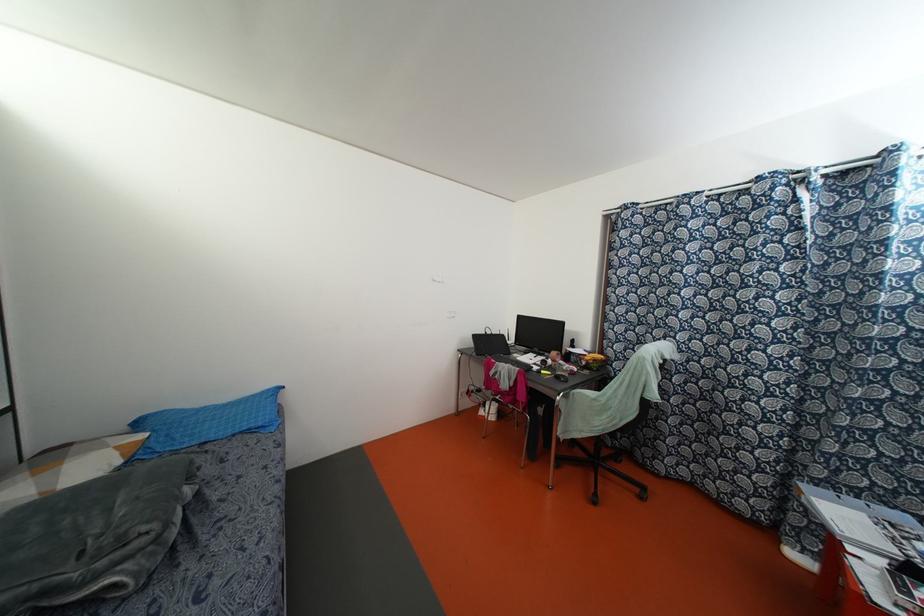
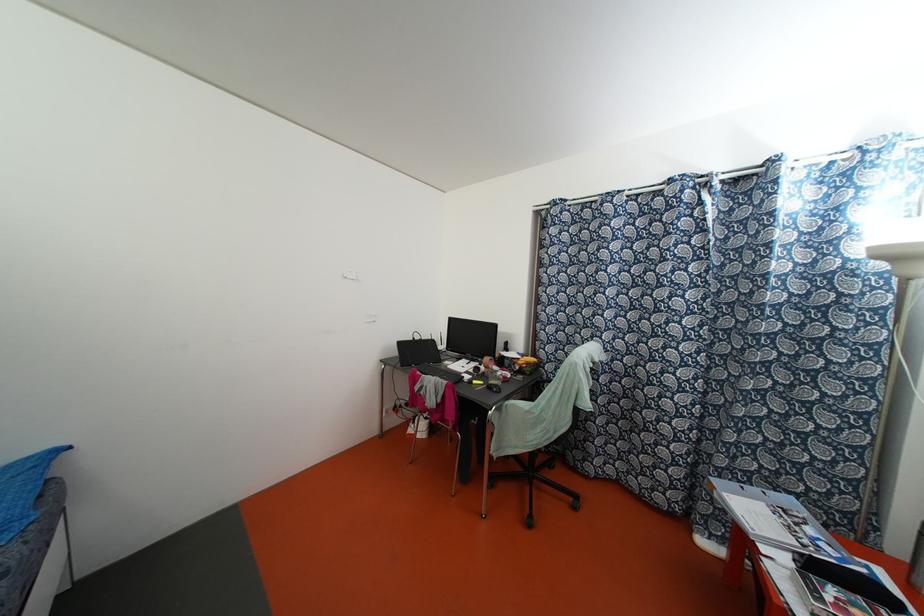
Question: The first image is from the beginning of the video and the second image is from the end. How did the camera likely rotate when shooting the video?

Choices:
 (A) Left
 (B) Right
 (C) Up
 (D) Down

Answer: (B)